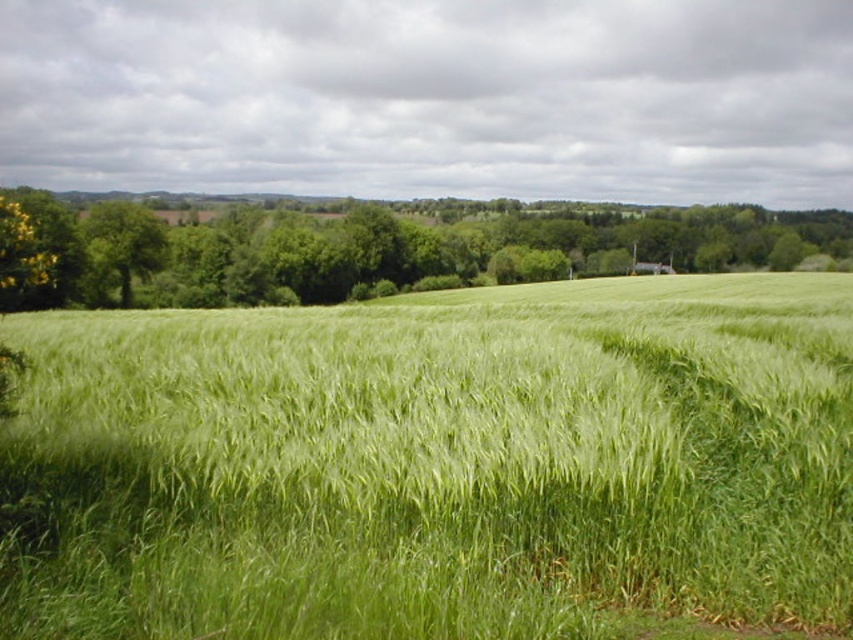
Can you confirm if green leafy tree at center is wider than green leafy tree at left?

Indeed, green leafy tree at center has a greater width compared to green leafy tree at left.

Who is positioned more to the left, green leafy tree at center or green leafy tree at left?

green leafy tree at left is more to the left.

Who is more distant from viewer, [184,291] or [93,248]?

The point [184,291] is more distant.

Where is `green leafy tree at center`? The image size is (853, 640). green leafy tree at center is located at coordinates (376, 248).

Between green grassy wheat field at center and green leafy tree at center, which one is positioned lower?

green grassy wheat field at center is lower down.

Is point (79, 568) positioned before point (230, 243)?

That is True.

At what (x,y) coordinates should I click in order to perform the action: click on green grassy wheat field at center. Please return your answer as a coordinate pair (x, y). The height and width of the screenshot is (640, 853). Looking at the image, I should click on (438, 464).

Between green grassy wheat field at center and green leafy tree at left, which one appears on the left side from the viewer's perspective?

From the viewer's perspective, green leafy tree at left appears more on the left side.

Does green grassy wheat field at center have a lesser width compared to green leafy tree at left?

No.

Describe the element at coordinates (438, 464) in the screenshot. The height and width of the screenshot is (640, 853). I see `green grassy wheat field at center` at that location.

You are a GUI agent. You are given a task and a screenshot of the screen. Output one action in this format:
    pyautogui.click(x=<x>, y=<y>)
    Task: Click on the green grassy wheat field at center
    Image resolution: width=853 pixels, height=640 pixels.
    Given the screenshot: What is the action you would take?
    438,464